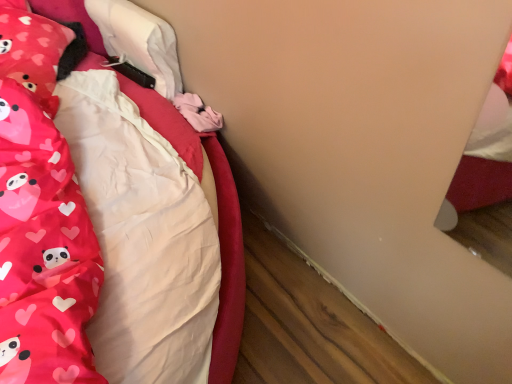
Image resolution: width=512 pixels, height=384 pixels. Describe the element at coordinates (32, 51) in the screenshot. I see `matte pink pillow at upper left` at that location.

Image resolution: width=512 pixels, height=384 pixels. Find the location of `matte pink pillow at upper left`. matte pink pillow at upper left is located at coordinates (32, 51).

This screenshot has height=384, width=512. In order to click on matte pink pillow at upper left in this screenshot , I will do `click(32, 51)`.